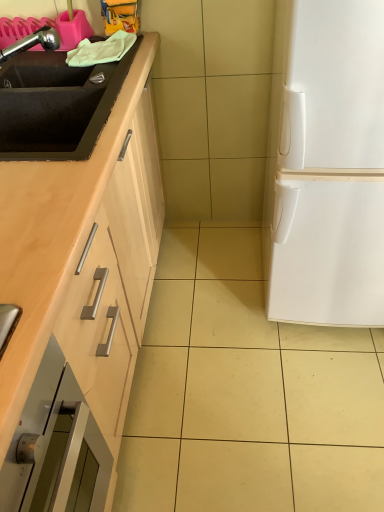
The height and width of the screenshot is (512, 384). Identify the location of black matte sink at left, which appears as the second sink when viewed from the top. (56, 105).

In the image, there is a black matte sink at left, which appears as the second sink when viewed from the top. Where is `sink above it (from the image's perspective)`? sink above it (from the image's perspective) is located at coordinates click(x=41, y=68).

From their relative heights in the image, would you say chrome metallic faucet at upper left, the second sink from the bottom, is taller or shorter than black matte sink at left, which appears as the second sink when viewed from the top?

Considering their sizes, chrome metallic faucet at upper left, the second sink from the bottom, has less height than black matte sink at left, which appears as the second sink when viewed from the top.

Is chrome metallic faucet at upper left, the second sink from the bottom, facing away from black matte sink at left, the 1th sink when ordered from bottom to top?

chrome metallic faucet at upper left, the second sink from the bottom, does not have its back to black matte sink at left, the 1th sink when ordered from bottom to top.

Looking at their sizes, would you say chrome metallic faucet at upper left, placed as the 1th sink when sorted from top to bottom, is wider or thinner than black matte sink at left, the 1th sink when ordered from bottom to top?

chrome metallic faucet at upper left, placed as the 1th sink when sorted from top to bottom, is thinner than black matte sink at left, the 1th sink when ordered from bottom to top.

Between white matte refrigerator at right and chrome metallic faucet at upper left, the second sink from the bottom, which one has smaller size?

Smaller between the two is chrome metallic faucet at upper left, the second sink from the bottom.

Which is farther, (367,286) or (18,51)?

Point (367,286)

In the scene shown: Is white matte refrigerator at right inside or outside of chrome metallic faucet at upper left, the second sink from the bottom?

white matte refrigerator at right is not enclosed by chrome metallic faucet at upper left, the second sink from the bottom.

Who is shorter, white matte refrigerator at right or chrome metallic faucet at upper left, the second sink from the bottom?

chrome metallic faucet at upper left, the second sink from the bottom.

Considering their positions, is chrome metallic faucet at upper left, the second sink from the bottom, located in front of or behind white matte refrigerator at right?

Visually, chrome metallic faucet at upper left, the second sink from the bottom, is located behind white matte refrigerator at right.

At what (x,y) coordinates should I click in order to perform the action: click on fridge below the chrome metallic faucet at upper left, placed as the 1th sink when sorted from top to bottom (from the image's perspective). Please return your answer as a coordinate pair (x, y). The height and width of the screenshot is (512, 384). Looking at the image, I should click on (327, 167).

Which is more to the right, chrome metallic faucet at upper left, the second sink from the bottom, or white matte refrigerator at right?

white matte refrigerator at right is more to the right.

Which of these two, chrome metallic faucet at upper left, placed as the 1th sink when sorted from top to bottom, or white matte refrigerator at right, stands shorter?

With less height is chrome metallic faucet at upper left, placed as the 1th sink when sorted from top to bottom.

Is white matte refrigerator at right in front of or behind black matte sink at left, which appears as the second sink when viewed from the top, in the image?

Visually, white matte refrigerator at right is located in front of black matte sink at left, which appears as the second sink when viewed from the top.

Looking at this image, is white matte refrigerator at right facing away from black matte sink at left, which appears as the second sink when viewed from the top?

No, white matte refrigerator at right is not facing the opposite direction of black matte sink at left, which appears as the second sink when viewed from the top.

Does white matte refrigerator at right have a smaller size compared to black matte sink at left, which appears as the second sink when viewed from the top?

No.

From a real-world perspective, is white matte refrigerator at right below black matte sink at left, which appears as the second sink when viewed from the top?

Correct, in the physical world, white matte refrigerator at right is lower than black matte sink at left, which appears as the second sink when viewed from the top.

Does black matte sink at left, the 1th sink when ordered from bottom to top, have a lesser height compared to chrome metallic faucet at upper left, placed as the 1th sink when sorted from top to bottom?

Incorrect, the height of black matte sink at left, the 1th sink when ordered from bottom to top, does not fall short of that of chrome metallic faucet at upper left, placed as the 1th sink when sorted from top to bottom.

Is black matte sink at left, which appears as the second sink when viewed from the top, to the left of chrome metallic faucet at upper left, placed as the 1th sink when sorted from top to bottom, from the viewer's perspective?

No.

Can you tell me how much black matte sink at left, the 1th sink when ordered from bottom to top, and chrome metallic faucet at upper left, the second sink from the bottom, differ in facing direction?

0.18 degrees.

Does black matte sink at left, the 1th sink when ordered from bottom to top, have a lesser width compared to white matte refrigerator at right?

Yes.

How many degrees apart are the facing directions of black matte sink at left, which appears as the second sink when viewed from the top, and white matte refrigerator at right?

The angle between the facing direction of black matte sink at left, which appears as the second sink when viewed from the top, and the facing direction of white matte refrigerator at right is 92.1 degrees.

Can you confirm if black matte sink at left, which appears as the second sink when viewed from the top, is positioned to the left of white matte refrigerator at right?

Indeed, black matte sink at left, which appears as the second sink when viewed from the top, is positioned on the left side of white matte refrigerator at right.

From a real-world perspective, which is physically below, black matte sink at left, which appears as the second sink when viewed from the top, or white matte refrigerator at right?

From a 3D spatial view, white matte refrigerator at right is below.

Locate an element on the screen. sink on the left of black matte sink at left, which appears as the second sink when viewed from the top is located at coordinates (41, 68).

Locate an element on the screen. The image size is (384, 512). fridge below the chrome metallic faucet at upper left, the second sink from the bottom (from a real-world perspective) is located at coordinates (327, 167).

When comparing their distances from black matte sink at left, the 1th sink when ordered from bottom to top, does white matte refrigerator at right or chrome metallic faucet at upper left, the second sink from the bottom, seem closer?

The object closer to black matte sink at left, the 1th sink when ordered from bottom to top, is chrome metallic faucet at upper left, the second sink from the bottom.

When comparing their distances from white matte refrigerator at right, does chrome metallic faucet at upper left, the second sink from the bottom, or black matte sink at left, which appears as the second sink when viewed from the top, seem further?

chrome metallic faucet at upper left, the second sink from the bottom, lies further to white matte refrigerator at right than the other object.

Estimate the real-world distances between objects in this image. Which object is further from white matte refrigerator at right, black matte sink at left, which appears as the second sink when viewed from the top, or chrome metallic faucet at upper left, placed as the 1th sink when sorted from top to bottom?

chrome metallic faucet at upper left, placed as the 1th sink when sorted from top to bottom.

Considering their positions, is white matte refrigerator at right positioned closer to chrome metallic faucet at upper left, placed as the 1th sink when sorted from top to bottom, than black matte sink at left, the 1th sink when ordered from bottom to top?

The object closer to chrome metallic faucet at upper left, placed as the 1th sink when sorted from top to bottom, is black matte sink at left, the 1th sink when ordered from bottom to top.

Which object lies nearer to the anchor point black matte sink at left, which appears as the second sink when viewed from the top, chrome metallic faucet at upper left, the second sink from the bottom, or white matte refrigerator at right?

The object closer to black matte sink at left, which appears as the second sink when viewed from the top, is chrome metallic faucet at upper left, the second sink from the bottom.

Looking at the image, which one is located closer to chrome metallic faucet at upper left, placed as the 1th sink when sorted from top to bottom, black matte sink at left, the 1th sink when ordered from bottom to top, or white matte refrigerator at right?

black matte sink at left, the 1th sink when ordered from bottom to top, is positioned closer to the anchor chrome metallic faucet at upper left, placed as the 1th sink when sorted from top to bottom.

The height and width of the screenshot is (512, 384). Find the location of `sink between chrome metallic faucet at upper left, the second sink from the bottom, and white matte refrigerator at right from left to right`. sink between chrome metallic faucet at upper left, the second sink from the bottom, and white matte refrigerator at right from left to right is located at coordinates (56, 105).